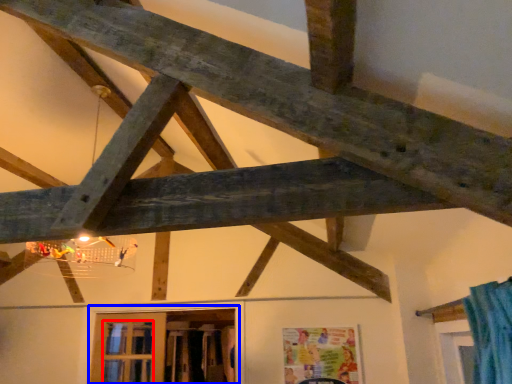
Question: Among these objects, which one is farthest to the camera, window (highlighted by a red box) or window (highlighted by a blue box)?

Choices:
 (A) window
 (B) window

Answer: (A)